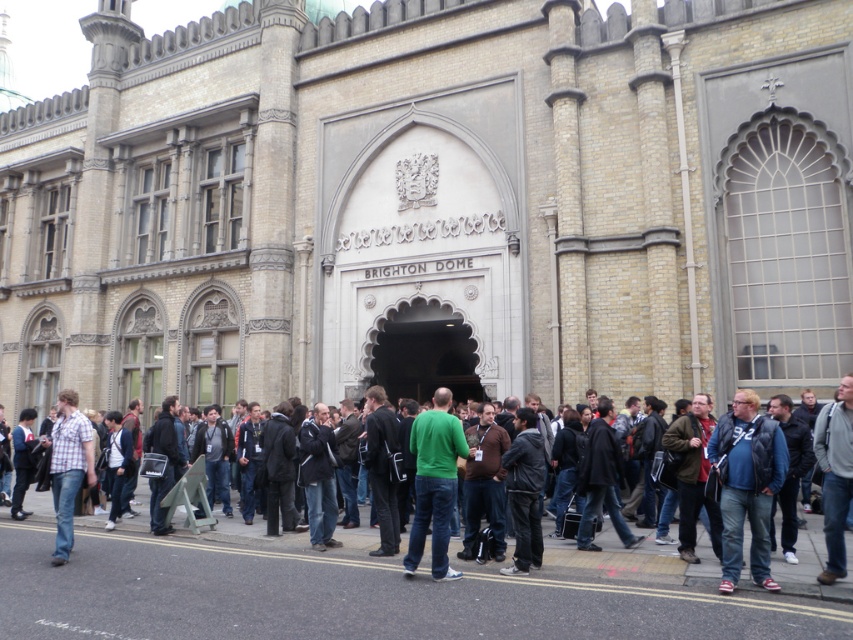
Is point (338, 545) positioned before point (824, 576)?

That is False.

Can you confirm if green sweater at center is smaller than gray cotton jacket at center?

Actually, green sweater at center might be larger than gray cotton jacket at center.

I want to click on green sweater at center, so click(610, 561).

Image resolution: width=853 pixels, height=640 pixels. I want to click on gray cotton jacket at center, so click(x=834, y=476).

Which is more to the right, gray cotton jacket at center or plaid shirt at center?

Positioned to the right is gray cotton jacket at center.

Which is in front, point (849, 448) or point (68, 422)?

Point (849, 448) is more forward.

Locate an element on the screen. This screenshot has width=853, height=640. gray cotton jacket at center is located at coordinates (834, 476).

Does matte blue jacket at center appear over plaid shirt at center?

Actually, matte blue jacket at center is below plaid shirt at center.

Is matte blue jacket at center bigger than plaid shirt at center?

Incorrect, matte blue jacket at center is not larger than plaid shirt at center.

Identify the location of matte blue jacket at center. This screenshot has width=853, height=640. (747, 484).

The image size is (853, 640). In order to click on matte blue jacket at center in this screenshot , I will do `click(747, 484)`.